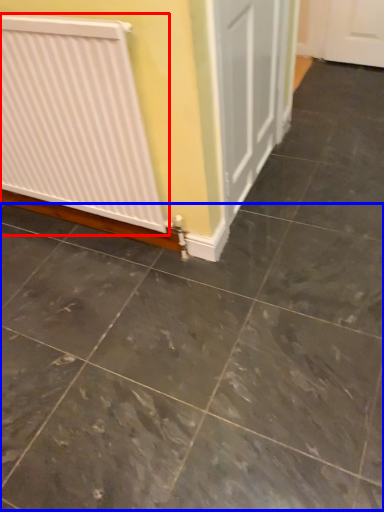
Question: Which object appears closest to the camera in this image, radiator (highlighted by a red box) or concrete (highlighted by a blue box)?

Choices:
 (A) radiator
 (B) concrete

Answer: (B)